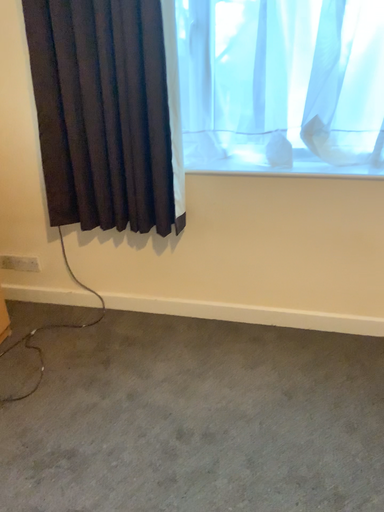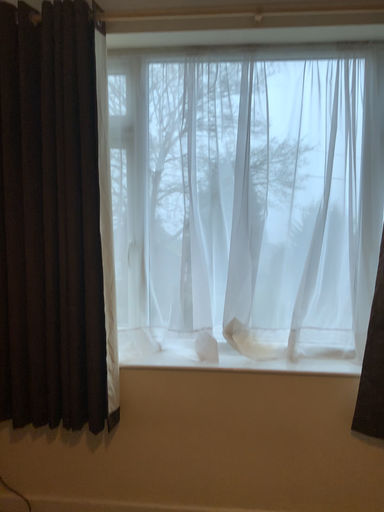
Question: How did the camera likely rotate when shooting the video?

Choices:
 (A) rotated downward
 (B) rotated upward

Answer: (B)